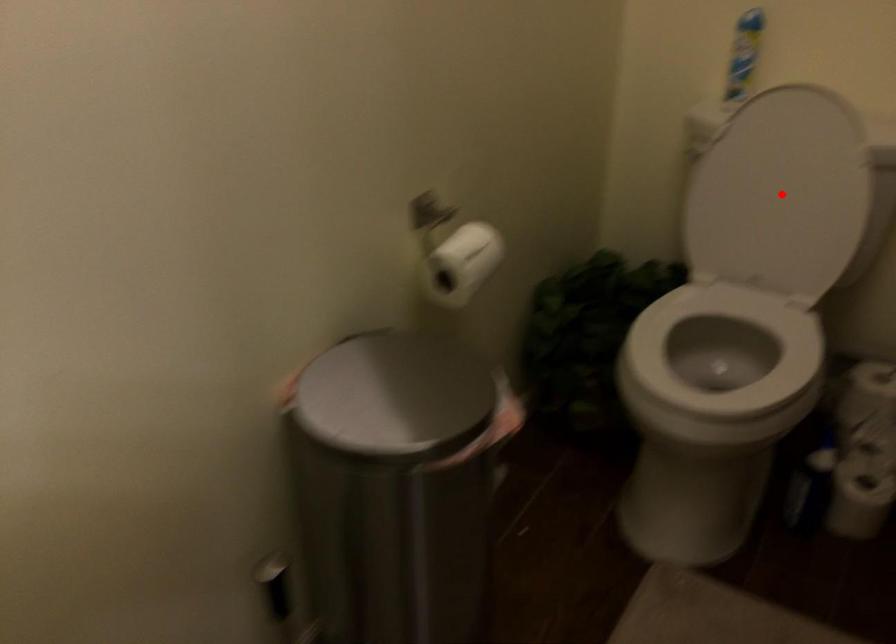
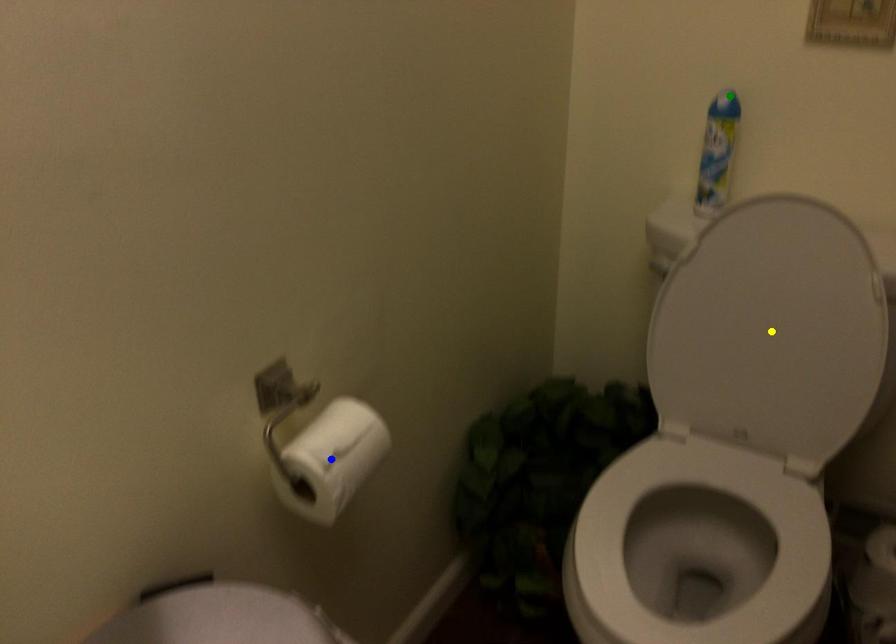
Question: I am providing you with two images of the same scene from different viewpoints. A red point is marked on the first image. You are given multiple points on the second image. In image 2, which mark is for the same physical point as the one in image 1?

Choices:
 (A) blue point
 (B) green point
 (C) yellow point

Answer: (C)